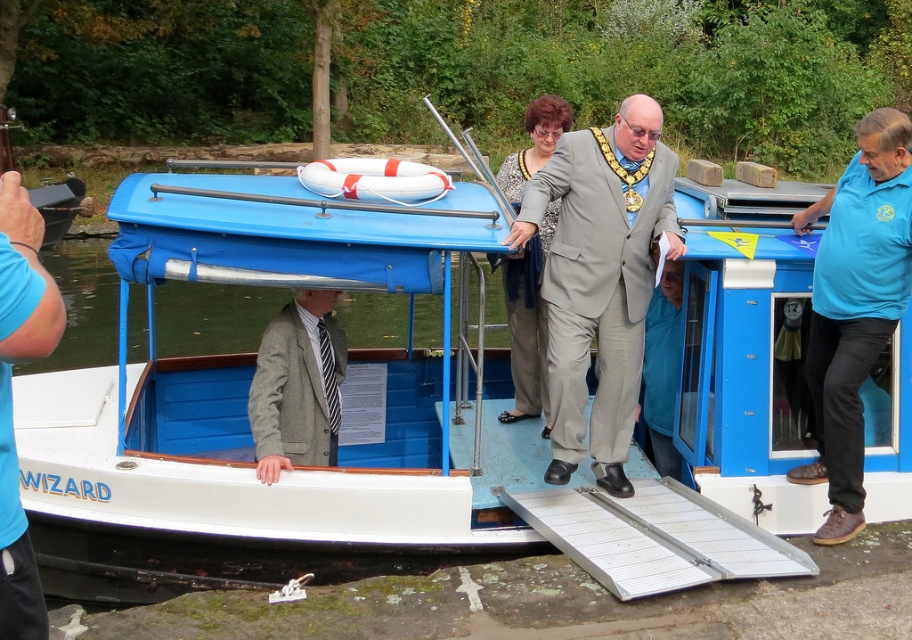
Between blue cotton shirt at right and gray suit at center, which one has less height?

blue cotton shirt at right is shorter.

Can you confirm if blue cotton shirt at right is positioned above gray suit at center?

No, blue cotton shirt at right is not above gray suit at center.

Find the location of `blue cotton shirt at right`. blue cotton shirt at right is located at coordinates (855, 305).

Which of these two, blue wood boat at center or gray suit at center, stands taller?

gray suit at center is taller.

Is point (415, 301) behind point (514, 200)?

Yes, it is behind point (514, 200).

This screenshot has width=912, height=640. Find the location of `blue wood boat at center`. blue wood boat at center is located at coordinates (212, 316).

Can you confirm if blue wood boat at center is bigger than gray woolen blazer at center?

Actually, blue wood boat at center might be smaller than gray woolen blazer at center.

Where is `blue wood boat at center`? blue wood boat at center is located at coordinates (212, 316).